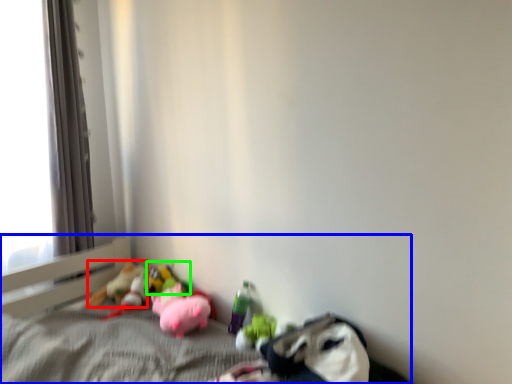
Question: Based on their relative distances, which object is nearer to toy (highlighted by a red box)? Choose from bed (highlighted by a blue box) and toy (highlighted by a green box).

Choices:
 (A) bed
 (B) toy

Answer: (B)